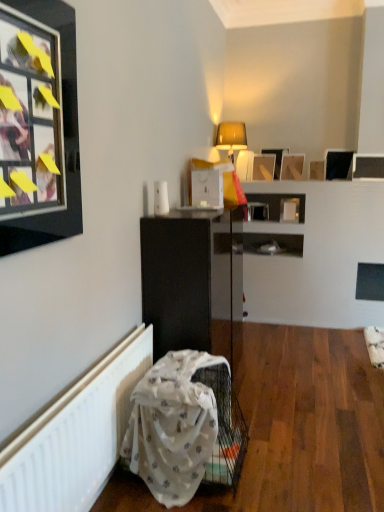
Measure the distance between point (284, 150) and camera.

The distance of point (284, 150) from camera is 4.49 meters.

Where is `wooden picture frame at upper center, which ranks as the third picture frame in left-to-right order`? wooden picture frame at upper center, which ranks as the third picture frame in left-to-right order is located at coordinates (276, 159).

Image resolution: width=384 pixels, height=512 pixels. Describe the element at coordinates (317, 170) in the screenshot. I see `wooden picture frame at upper center, the fifth picture frame from the back` at that location.

Where is `black glossy shelf at lower center`? black glossy shelf at lower center is located at coordinates (193, 282).

This screenshot has width=384, height=512. Describe the element at coordinates (263, 167) in the screenshot. I see `wooden picture frame at upper center, the second picture frame in the back-to-front sequence` at that location.

What do you see at coordinates (292, 167) in the screenshot? I see `wooden picture frame at upper center, positioned as the third picture frame in back-to-front order` at bounding box center [292, 167].

In order to face white fabric swivel chair at lower left, should I rotate leftwards or rightwards?

To align with it, rotate left about 0.430°.

The width and height of the screenshot is (384, 512). Identify the location of matte black picture frame at upper left, the 7th picture frame from the back. 65,137.

At what (x,y) coordinates should I click in order to perform the action: click on wooden picture frame at upper center, the seventh picture frame in the front-to-back sequence. Please return your answer as a coordinate pair (x, y). Looking at the image, I should click on (276, 159).

Is black glossy picture frame at upper right, arranged as the second picture frame when viewed from the right, outside of wooden picture frame at upper center, positioned as the third picture frame in front-to-back order?

That's correct, black glossy picture frame at upper right, arranged as the second picture frame when viewed from the right, is outside of wooden picture frame at upper center, positioned as the third picture frame in front-to-back order.

Would you say black glossy picture frame at upper right, arranged as the second picture frame when viewed from the right, is a long distance from wooden picture frame at upper center, positioned as the third picture frame in front-to-back order?

No, black glossy picture frame at upper right, arranged as the second picture frame when viewed from the right, is not far from wooden picture frame at upper center, positioned as the third picture frame in front-to-back order.

Considering the relative sizes of black glossy picture frame at upper right, the 4th picture frame positioned from the back, and wooden picture frame at upper center, which is the 3th picture frame in right-to-left order, in the image provided, is black glossy picture frame at upper right, the 4th picture frame positioned from the back, shorter than wooden picture frame at upper center, which is the 3th picture frame in right-to-left order,?

In fact, black glossy picture frame at upper right, the 4th picture frame positioned from the back, may be taller than wooden picture frame at upper center, which is the 3th picture frame in right-to-left order.

Is black glossy picture frame at upper right, arranged as the second picture frame when viewed from the right, smaller than wooden picture frame at upper center, the fifth picture frame from the back?

No, black glossy picture frame at upper right, arranged as the second picture frame when viewed from the right, is not smaller than wooden picture frame at upper center, the fifth picture frame from the back.

From the image's perspective, which is above, matte black picture frame at upper right, which appears as the 6th picture frame when viewed from the back, or matte black picture frame at upper left, which is counted as the first picture frame, starting from the left?

matte black picture frame at upper right, which appears as the 6th picture frame when viewed from the back, from the image's perspective.

Identify the location of the 4th picture frame above the matte black picture frame at upper right, the 2th picture frame when ordered from front to back (from a real-world perspective). Image resolution: width=384 pixels, height=512 pixels. (65, 137).

Between matte black picture frame at upper right, which is the 1th picture frame from right to left, and matte black picture frame at upper left, which is counted as the first picture frame, starting from the left, which one has smaller size?

With smaller size is matte black picture frame at upper right, which is the 1th picture frame from right to left.

How many degrees apart are the facing directions of matte black picture frame at upper right, which appears as the 6th picture frame when viewed from the back, and matte black picture frame at upper left, which is counted as the seventh picture frame, starting from the right?

The angle between the facing direction of matte black picture frame at upper right, which appears as the 6th picture frame when viewed from the back, and the facing direction of matte black picture frame at upper left, which is counted as the seventh picture frame, starting from the right, is 92.9 degrees.

Is wooden picture frame at upper center, the sixth picture frame when ordered from front to back, looking in the opposite direction of black glossy shelf at lower center?

wooden picture frame at upper center, the sixth picture frame when ordered from front to back, does not have its back to black glossy shelf at lower center.

Is point (274, 158) farther from camera compared to point (141, 241)?

Yes, point (274, 158) is behind point (141, 241).

Are wooden picture frame at upper center, which is the 6th picture frame in right-to-left order, and black glossy shelf at lower center located far from each other?

Yes, wooden picture frame at upper center, which is the 6th picture frame in right-to-left order, and black glossy shelf at lower center are located far from each other.

Does wooden picture frame at upper center, the second picture frame in the back-to-front sequence, appear on the left side of black glossy shelf at lower center?

No, wooden picture frame at upper center, the second picture frame in the back-to-front sequence, is not to the left of black glossy shelf at lower center.

Can we say matte black picture frame at upper left, which is counted as the first picture frame, starting from the left, lies outside matte black picture frame at upper right, the 2th picture frame when ordered from front to back?

matte black picture frame at upper left, which is counted as the first picture frame, starting from the left, is positioned outside matte black picture frame at upper right, the 2th picture frame when ordered from front to back.

Is matte black picture frame at upper left, the 7th picture frame from the back, in front of matte black picture frame at upper right, the 2th picture frame when ordered from front to back?

Yes, matte black picture frame at upper left, the 7th picture frame from the back, is closer to the camera.

Is matte black picture frame at upper left, the 7th picture frame from the back, taller than matte black picture frame at upper right, which appears as the 6th picture frame when viewed from the back?

Yes.

Is white textured radiator at lower left oriented away from wooden picture frame at upper center, positioned as the third picture frame in back-to-front order?

white textured radiator at lower left does not have its back to wooden picture frame at upper center, positioned as the third picture frame in back-to-front order.

Choose the correct answer: Is white textured radiator at lower left inside wooden picture frame at upper center, positioned as the third picture frame in back-to-front order, or outside it?

white textured radiator at lower left is located beyond the bounds of wooden picture frame at upper center, positioned as the third picture frame in back-to-front order.

Can you confirm if white textured radiator at lower left is thinner than wooden picture frame at upper center, the fifth picture frame when ordered from front to back?

Yes.

Consider the image. Measure the distance from white textured radiator at lower left to wooden picture frame at upper center, the fourth picture frame positioned from the left.

The distance of white textured radiator at lower left from wooden picture frame at upper center, the fourth picture frame positioned from the left, is 10.00 feet.

Can you tell me how much white textured radiator at lower left and matte black picture frame at upper left, which is counted as the first picture frame, starting from the left, differ in facing direction?

The facing directions of white textured radiator at lower left and matte black picture frame at upper left, which is counted as the first picture frame, starting from the left, are 1.13 degrees apart.

Is white textured radiator at lower left far from matte black picture frame at upper left, marked as the first picture frame in a front-to-back arrangement?

No, there isn't a large distance between white textured radiator at lower left and matte black picture frame at upper left, marked as the first picture frame in a front-to-back arrangement.

Can you confirm if white textured radiator at lower left is thinner than matte black picture frame at upper left, marked as the first picture frame in a front-to-back arrangement?

Indeed, white textured radiator at lower left has a lesser width compared to matte black picture frame at upper left, marked as the first picture frame in a front-to-back arrangement.

Considering the positions of objects white textured radiator at lower left and matte black picture frame at upper left, the 7th picture frame from the back, in the image provided, who is behind, white textured radiator at lower left or matte black picture frame at upper left, the 7th picture frame from the back,?

white textured radiator at lower left is further away from the camera.

Is wooden picture frame at upper center, positioned as the third picture frame in back-to-front order, wider or thinner than black glossy shelf at lower center?

In the image, wooden picture frame at upper center, positioned as the third picture frame in back-to-front order, appears to be more narrow than black glossy shelf at lower center.

Who is bigger, wooden picture frame at upper center, marked as the 4th picture frame in a right-to-left arrangement, or black glossy shelf at lower center?

black glossy shelf at lower center.

From a real-world perspective, is wooden picture frame at upper center, positioned as the third picture frame in back-to-front order, located beneath black glossy shelf at lower center?

No, from a real-world perspective, wooden picture frame at upper center, positioned as the third picture frame in back-to-front order, is not below black glossy shelf at lower center.

Where is `the 4th picture frame positioned below the black glossy picture frame at upper right, the sixth picture frame in the left-to-right sequence (from a real-world perspective)`? The width and height of the screenshot is (384, 512). the 4th picture frame positioned below the black glossy picture frame at upper right, the sixth picture frame in the left-to-right sequence (from a real-world perspective) is located at coordinates (317, 170).

At what (x,y) coordinates should I click in order to perform the action: click on picture frame that is the 6th one when counting leftward from the matte black picture frame at upper right, arranged as the seventh picture frame when viewed from the left. Please return your answer as a coordinate pair (x, y). The width and height of the screenshot is (384, 512). Looking at the image, I should click on (65, 137).

Consider the image. From the image, which object appears to be nearer to wooden picture frame at upper center, which is the 3th picture frame in right-to-left order, white fabric swivel chair at lower left or wooden picture frame at upper center, which is the 6th picture frame in right-to-left order?

wooden picture frame at upper center, which is the 6th picture frame in right-to-left order, is closer to wooden picture frame at upper center, which is the 3th picture frame in right-to-left order.

Looking at the image, which one is located closer to wooden picture frame at upper center, the fifth picture frame when ordered from front to back, black glossy picture frame at upper right, marked as the fourth picture frame in a front-to-back arrangement, or wooden picture frame at upper center, which is the 6th picture frame in right-to-left order?

wooden picture frame at upper center, which is the 6th picture frame in right-to-left order, lies closer to wooden picture frame at upper center, the fifth picture frame when ordered from front to back, than the other object.

When comparing their distances from wooden picture frame at upper center, which is the 6th picture frame in right-to-left order, does wooden picture frame at upper center, arranged as the 5th picture frame when viewed from the right, or black glossy shelf at lower center seem closer?

wooden picture frame at upper center, arranged as the 5th picture frame when viewed from the right, is closer to wooden picture frame at upper center, which is the 6th picture frame in right-to-left order.

Which object lies nearer to the anchor point black glossy picture frame at upper right, arranged as the second picture frame when viewed from the right, white textured radiator at lower left or wooden picture frame at upper center, marked as the 4th picture frame in a right-to-left arrangement?

wooden picture frame at upper center, marked as the 4th picture frame in a right-to-left arrangement, is positioned closer to the anchor black glossy picture frame at upper right, arranged as the second picture frame when viewed from the right.

Based on their spatial positions, is black glossy picture frame at upper right, the sixth picture frame in the left-to-right sequence, or white fabric swivel chair at lower left further from matte black picture frame at upper left, which is counted as the first picture frame, starting from the left?

black glossy picture frame at upper right, the sixth picture frame in the left-to-right sequence.

When comparing their distances from matte yellow table lamp at upper center, does wooden picture frame at upper center, which appears as the first picture frame when viewed from the back, or wooden picture frame at upper center, positioned as the third picture frame in back-to-front order, seem further?

The object further to matte yellow table lamp at upper center is wooden picture frame at upper center, positioned as the third picture frame in back-to-front order.

From the image, which object appears to be nearer to black glossy shelf at lower center, wooden picture frame at upper center, positioned as the third picture frame in back-to-front order, or white fabric swivel chair at lower left?

wooden picture frame at upper center, positioned as the third picture frame in back-to-front order, is positioned closer to the anchor black glossy shelf at lower center.

Looking at the image, which one is located closer to wooden picture frame at upper center, marked as the 4th picture frame in a right-to-left arrangement, matte black picture frame at upper left, marked as the first picture frame in a front-to-back arrangement, or black glossy picture frame at upper right, marked as the fourth picture frame in a front-to-back arrangement?

black glossy picture frame at upper right, marked as the fourth picture frame in a front-to-back arrangement, lies closer to wooden picture frame at upper center, marked as the 4th picture frame in a right-to-left arrangement, than the other object.

I want to click on table lamp between black glossy shelf at lower center and wooden picture frame at upper center, marked as the 4th picture frame in a right-to-left arrangement, in the front-back direction, so click(231, 137).

The width and height of the screenshot is (384, 512). I want to click on shelf located between white textured radiator at lower left and matte yellow table lamp at upper center in the depth direction, so click(193, 282).

I want to click on shelf between matte black picture frame at upper left, marked as the first picture frame in a front-to-back arrangement, and matte yellow table lamp at upper center in the front-back direction, so click(193, 282).

The height and width of the screenshot is (512, 384). I want to click on swivel chair between matte black picture frame at upper left, the 7th picture frame from the back, and wooden picture frame at upper center, the fifth picture frame when ordered from front to back, along the z-axis, so click(185, 426).